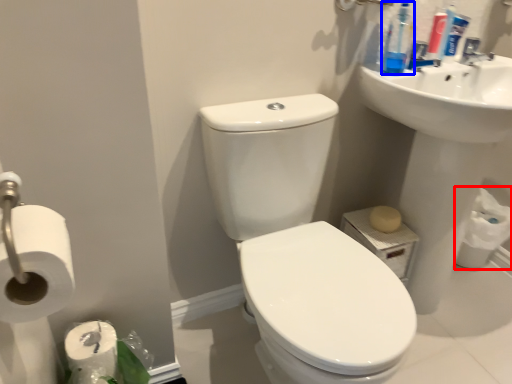
Question: Which object appears farthest to the camera in this image, toilet paper (highlighted by a red box) or cleaning product (highlighted by a blue box)?

Choices:
 (A) toilet paper
 (B) cleaning product

Answer: (A)